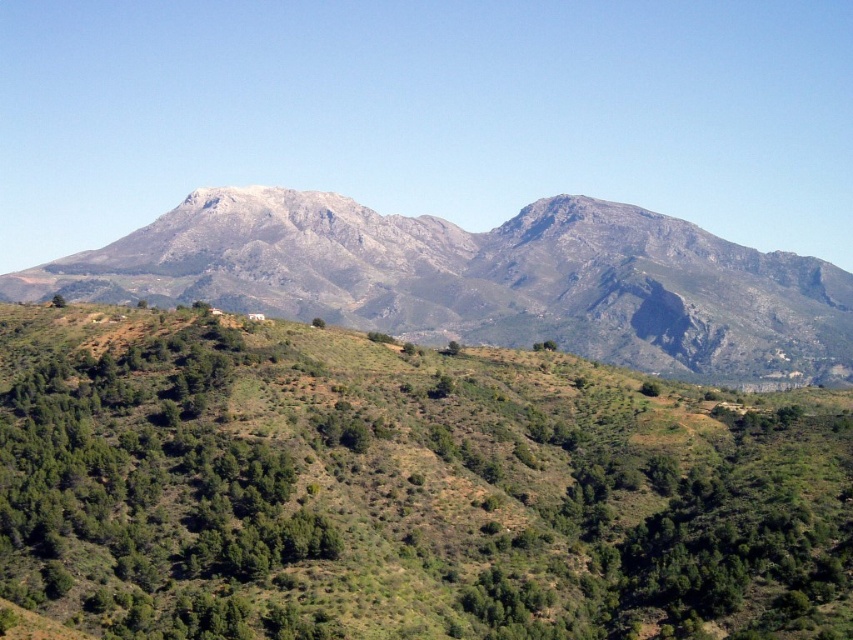
Is gray rocky mountain range at center wider than green leafy shrub at center-left?

Yes.

Is gray rocky mountain range at center further to the viewer compared to green leafy shrub at center-left?

That is True.

Where is `gray rocky mountain range at center`? This screenshot has height=640, width=853. gray rocky mountain range at center is located at coordinates (485, 280).

Is point (718, 547) in front of point (199, 408)?

Yes.

Who is taller, gray rocky mountain at center or green leafy shrub at center-left?

With more height is gray rocky mountain at center.

Where is `gray rocky mountain at center`? This screenshot has width=853, height=640. gray rocky mountain at center is located at coordinates (427, 429).

From the picture: Is gray rocky mountain range at center shorter than green leafy tree at lower left?

No.

This screenshot has height=640, width=853. What do you see at coordinates (485, 280) in the screenshot?
I see `gray rocky mountain range at center` at bounding box center [485, 280].

The image size is (853, 640). I want to click on gray rocky mountain range at center, so click(485, 280).